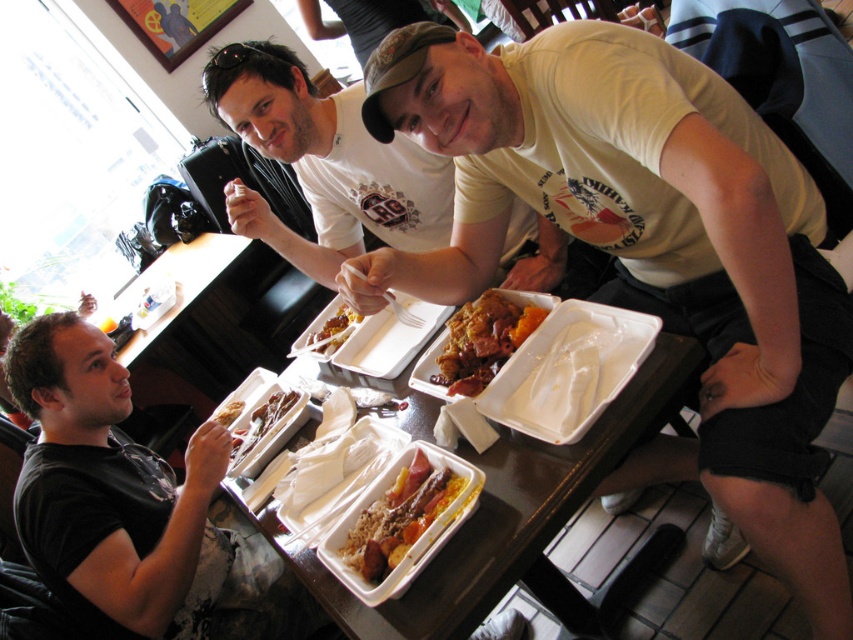
In the scene shown: You are trying to pick up the yellow matte rice at center with the shiny plastic fork at center. Based on their sizes, will the fork be able to reach the rice?

The shiny plastic fork at center is much taller than yellow matte rice at center, so the fork can easily reach the rice.